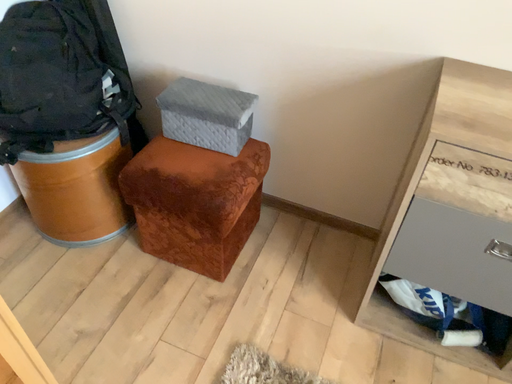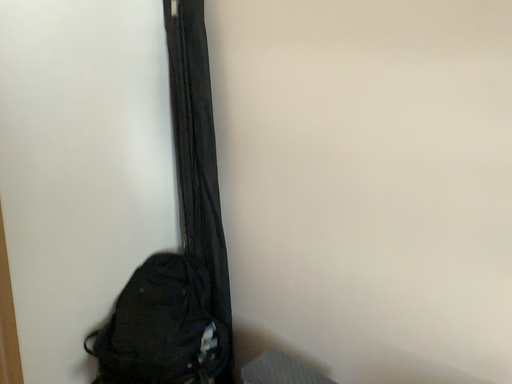
Question: Which way did the camera rotate in the video?

Choices:
 (A) rotated left
 (B) rotated right

Answer: (A)